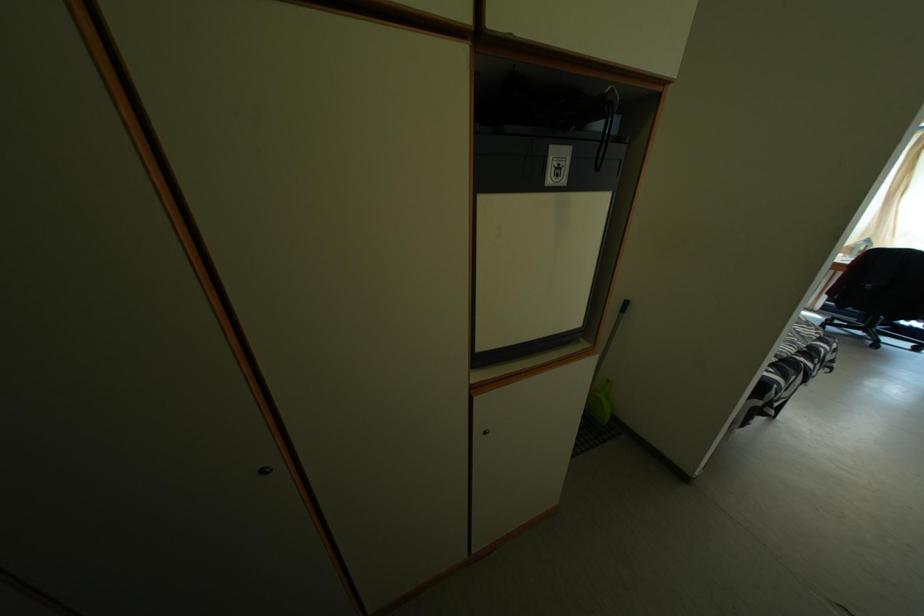
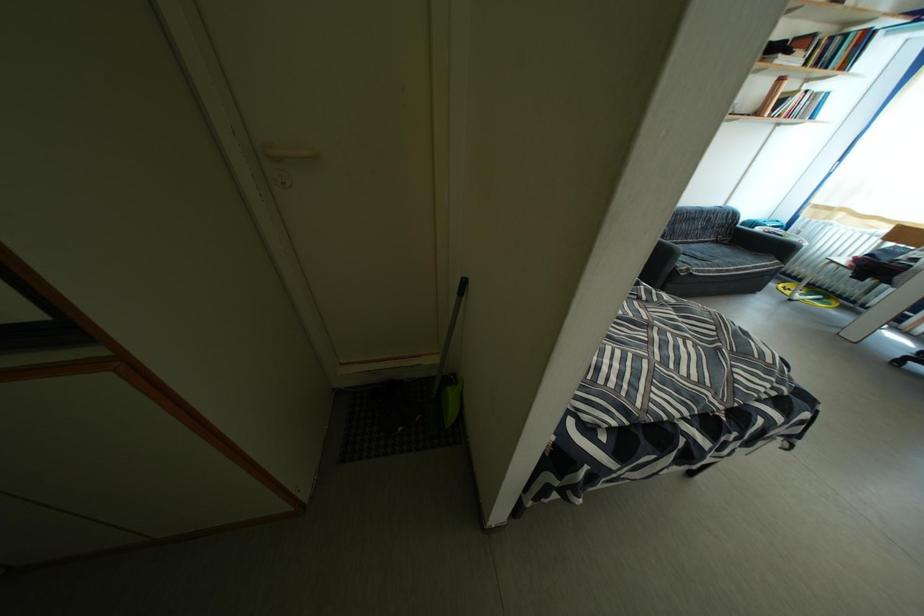
In a continuous first-person perspective shot, in which direction is the camera moving?

The cameraman moved toward right, forward.